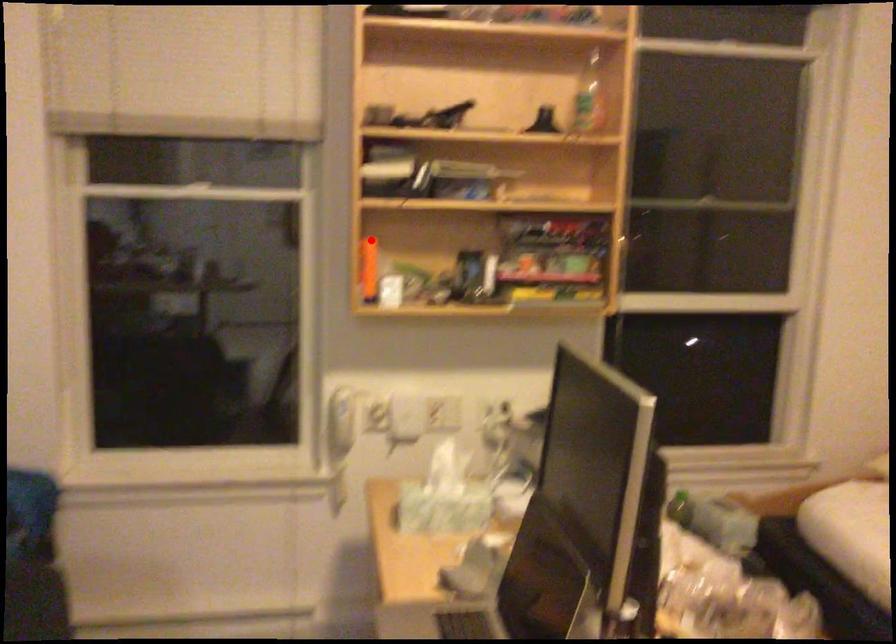
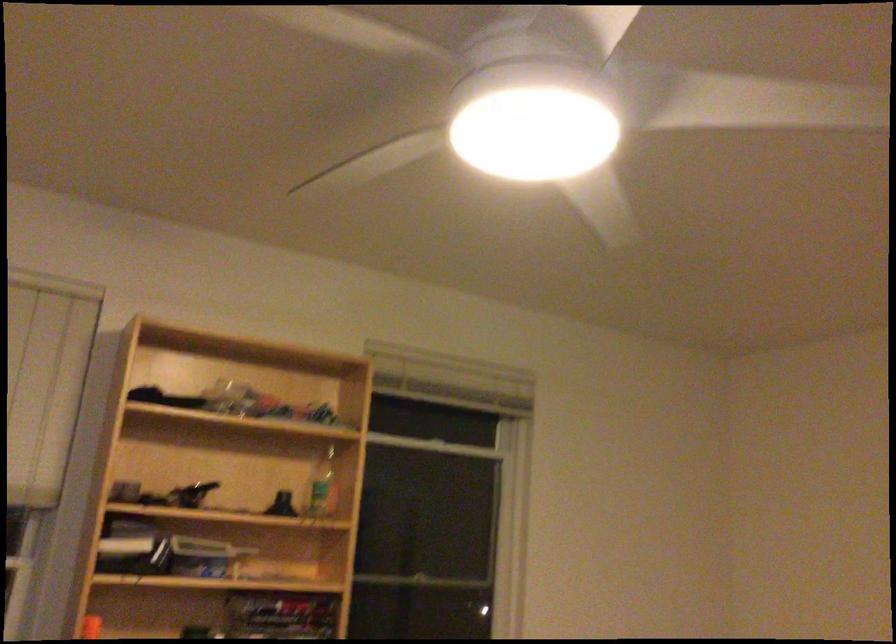
Question: I am providing you with two images of the same scene from different viewpoints. A red point is shown in image1. For the corresponding object point in image2, is it positioned nearer or farther from the camera?

Choices:
 (A) Nearer
 (B) Farther

Answer: (A)